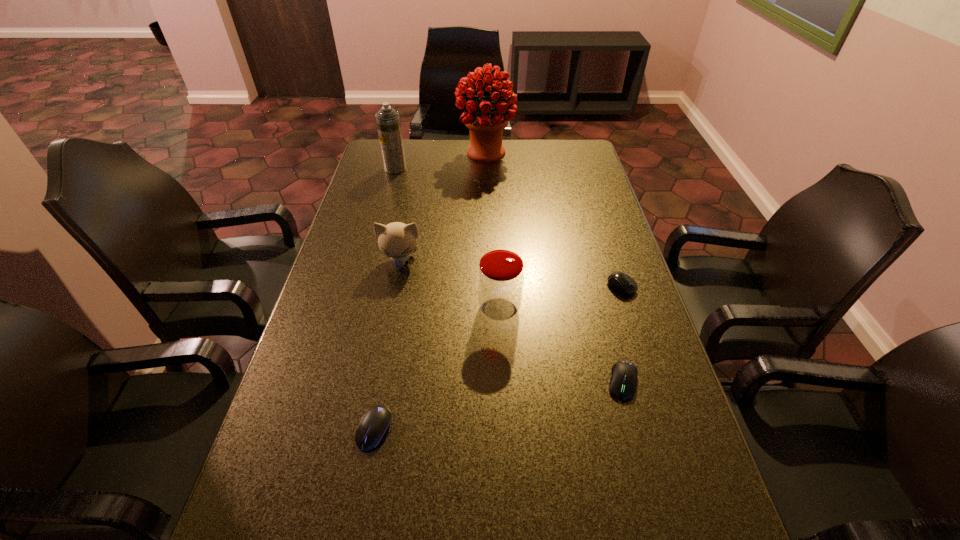
You are a GUI agent. You are given a task and a screenshot of the screen. Output one action in this format:
    pyautogui.click(x=<x>, y=<y>)
    Task: Click on the bouquet
    The height and width of the screenshot is (540, 960).
    Given the screenshot: What is the action you would take?
    pyautogui.click(x=486, y=123)

This screenshot has height=540, width=960. In order to click on aerosol can in this screenshot , I will do `click(388, 121)`.

What are the coordinates of `jar` in the screenshot? It's located at (500, 277).

Find the location of a particular element. kitten is located at coordinates (396, 240).

I want to click on the fourth shortest object, so click(x=396, y=240).

The image size is (960, 540). I want to click on the farthest computer mouse, so click(x=621, y=282).

Where is `the second farthest computer mouse`? the second farthest computer mouse is located at coordinates (623, 382).

Identify the location of the nearest computer mouse. This screenshot has width=960, height=540. (375, 423).

Locate an element on the screen. the leftmost computer mouse is located at coordinates (375, 423).

The image size is (960, 540). Find the location of `free spot located 0.270m on the left of the tallest object`. free spot located 0.270m on the left of the tallest object is located at coordinates (389, 153).